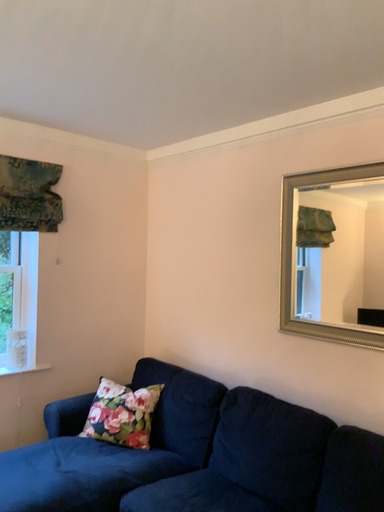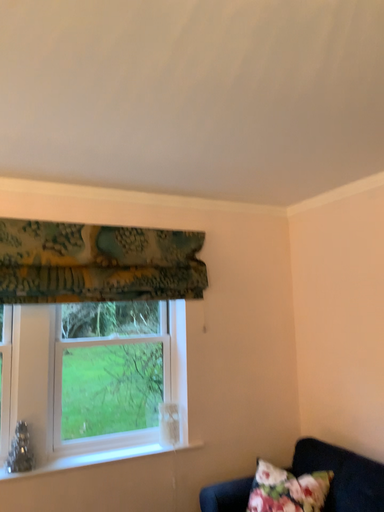
Question: Which way did the camera rotate in the video?

Choices:
 (A) rotated downward
 (B) rotated upward

Answer: (B)